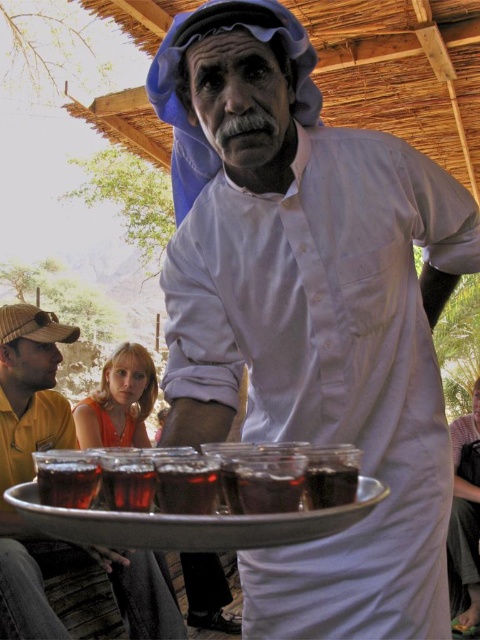
Between matte white tray at lower center and dark brown glass at center, which one is positioned higher?

dark brown glass at center is above.

How far apart are matte white tray at lower center and dark brown glass at center?

A distance of 2.25 meters exists between matte white tray at lower center and dark brown glass at center.

Does point (15, 628) lie behind point (355, 465)?

That is True.

Find the location of a particular element. The image size is (480, 640). matte white tray at lower center is located at coordinates (28, 452).

Does translucent glass cup at lower left have a smaller size compared to translucent glass cup at lower center?

No, translucent glass cup at lower left is not smaller than translucent glass cup at lower center.

Is point (79, 458) farther from viewer compared to point (103, 477)?

Yes, it is behind point (103, 477).

Does point (48, 465) lie in front of point (127, 499)?

No, (48, 465) is behind (127, 499).

You are a GUI agent. You are given a task and a screenshot of the screen. Output one action in this format:
    pyautogui.click(x=<x>, y=<y>)
    Task: Click on the translucent glass cup at lower left
    The width and height of the screenshot is (480, 640).
    Given the screenshot: What is the action you would take?
    pyautogui.click(x=68, y=483)

Is point (8, 586) farther from viewer compared to point (282, 506)?

Yes, it is behind point (282, 506).

Does matte white tray at lower center appear under translucent glass cup at center?

Indeed, matte white tray at lower center is positioned under translucent glass cup at center.

Is point (126, 614) closer to camera compared to point (235, 472)?

No, (126, 614) is further to viewer.

Where is `matte white tray at lower center`? The width and height of the screenshot is (480, 640). matte white tray at lower center is located at coordinates (28, 452).